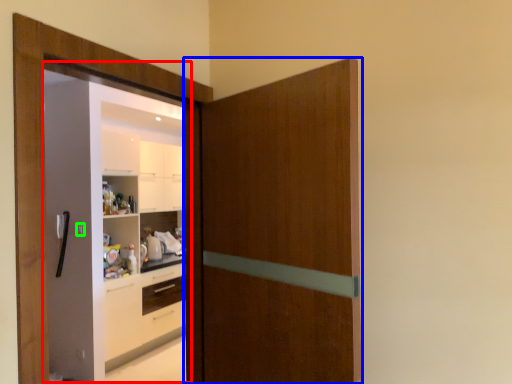
Question: Which object is positioned closest to screen door (highlighted by a red box)? Select from door (highlighted by a blue box) and door handle (highlighted by a green box).

Choices:
 (A) door
 (B) door handle

Answer: (B)